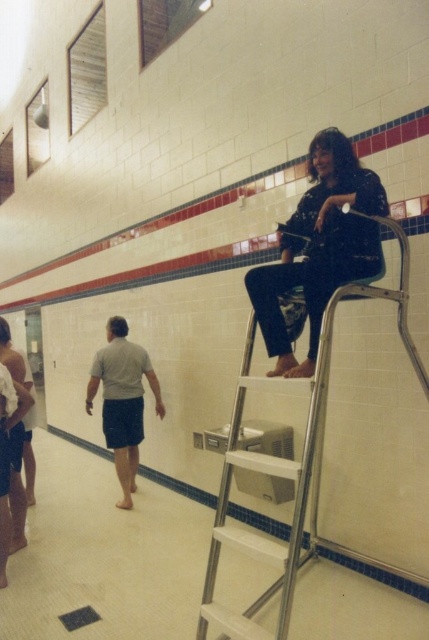
Question: Based on their relative distances, which object is farther from the gray cotton shorts at lower left?

Choices:
 (A) silver metallic ladder at upper center
 (B) matte black shirt at upper right

Answer: (B)

Question: Can you confirm if silver metallic ladder at upper center is positioned to the right of matte black shirt at upper right?

Choices:
 (A) yes
 (B) no

Answer: (A)

Question: Can you confirm if silver metallic ladder at upper center is positioned to the left of matte black shirt at upper right?

Choices:
 (A) yes
 (B) no

Answer: (B)

Question: Which object is farther from the camera taking this photo?

Choices:
 (A) gray cotton shorts at lower left
 (B) silver metallic ladder at upper center

Answer: (A)

Question: Which point is farther from the camera taking this photo?

Choices:
 (A) (135, 419)
 (B) (369, 172)

Answer: (A)

Question: Is silver metallic ladder at upper center smaller than gray cotton shorts at lower left?

Choices:
 (A) yes
 (B) no

Answer: (B)